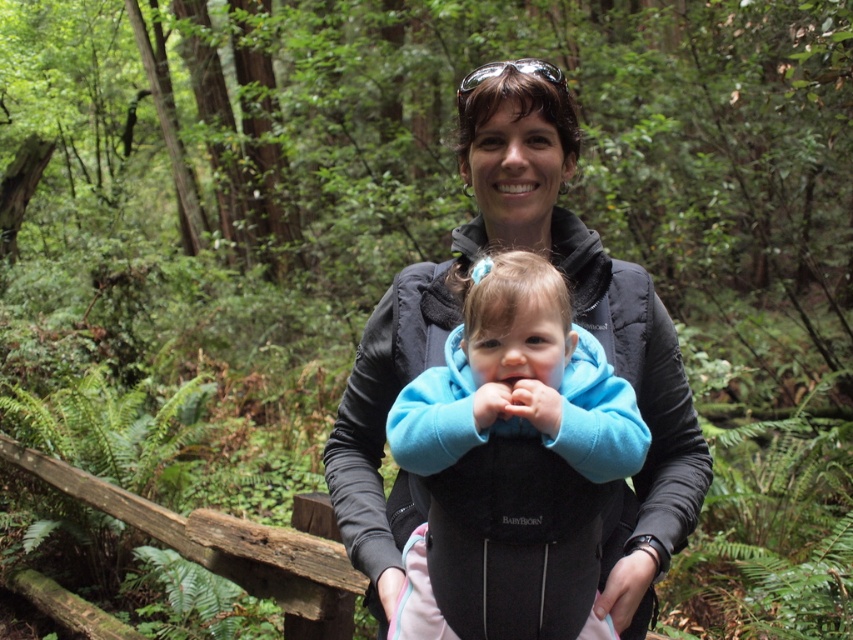
You are a hiker who just arrived at the forest and see the image. You need to locate the black softshell jacket at center. Where exactly is it located in the image?

The black softshell jacket at center is located at point (514, 438) in the image.

You are a photographer setting up a shot of the black softshell jacket at center and the blue fleece baby at center. Which object should you adjust your camera angle to focus on first if you want to capture the wider subject?

The black softshell jacket at center is wider than the blue fleece baby at center, so you should focus on the black softshell jacket at center first to capture the wider subject.